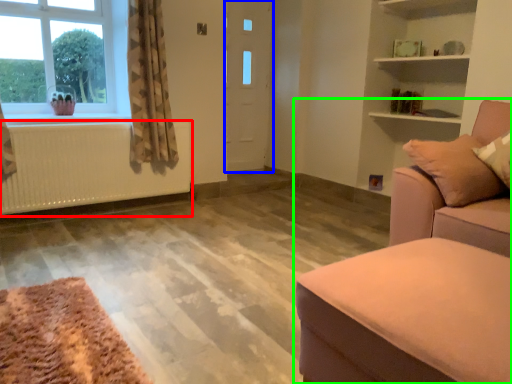
Question: Based on their relative distances, which object is farther from radiator (highlighted by a red box)? Choose from door (highlighted by a blue box) and studio couch (highlighted by a green box).

Choices:
 (A) door
 (B) studio couch

Answer: (B)